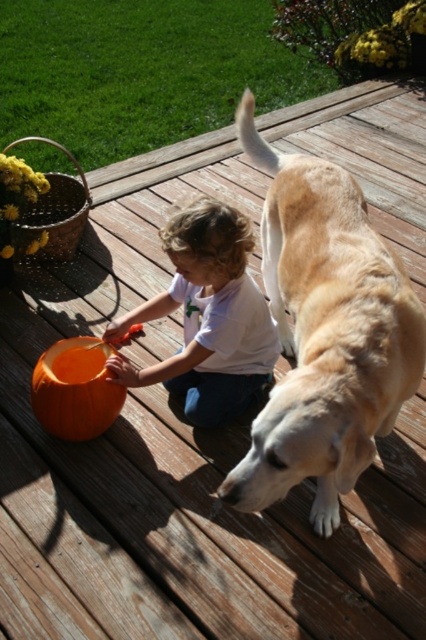
Who is positioned more to the left, white cotton shirt at center or orange matte pumpkin at center?

From the viewer's perspective, orange matte pumpkin at center appears more on the left side.

Which is below, white cotton shirt at center or orange matte pumpkin at center?

orange matte pumpkin at center is below.

Where is `white cotton shirt at center`? white cotton shirt at center is located at coordinates (207, 316).

Is golden fur dog at center further to camera compared to white cotton shirt at center?

No, it is in front of white cotton shirt at center.

In the scene shown: Who is more distant from viewer, (304, 266) or (229, 305)?

Point (229, 305)

In order to click on golden fur dog at center in this screenshot , I will do `click(325, 333)`.

Which is below, golden fur dog at center or orange matte pumpkin at center?

Positioned lower is orange matte pumpkin at center.

Who is more distant from viewer, (319, 230) or (92, 348)?

The point (92, 348) is behind.

Where is `golden fur dog at center`? The width and height of the screenshot is (426, 640). golden fur dog at center is located at coordinates (325, 333).